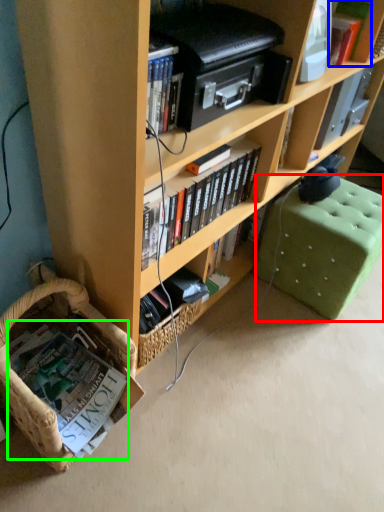
Question: Which object is the farthest from swivel chair (highlighted by a red box)? Choose among these: book (highlighted by a blue box) or book (highlighted by a green box).

Choices:
 (A) book
 (B) book

Answer: (B)